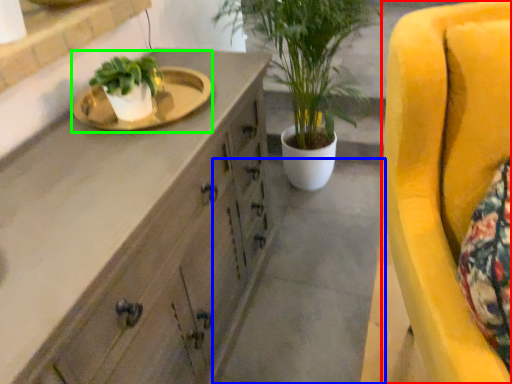
Question: Estimate the real-world distances between objects in this image. Which object is closer to chair (highlighted by a red box), concrete (highlighted by a blue box) or sink (highlighted by a green box)?

Choices:
 (A) concrete
 (B) sink

Answer: (B)